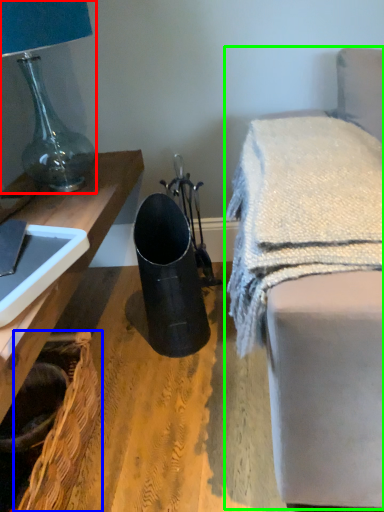
Question: Considering the real-world distances, which object is closest to lamp (highlighted by a red box)? basket (highlighted by a blue box) or furniture (highlighted by a green box).

Choices:
 (A) basket
 (B) furniture

Answer: (A)